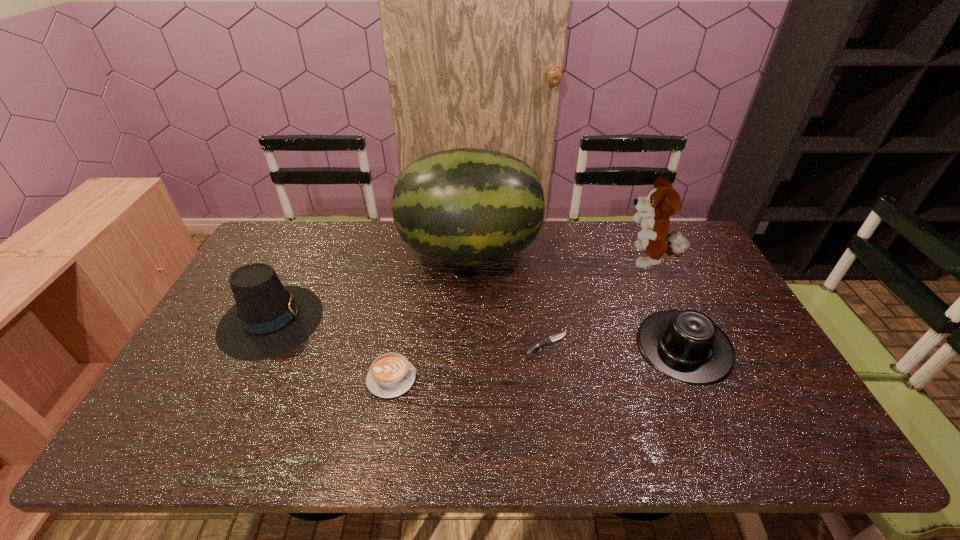
Identify the location of free area in between the fourth tallest object and the shortest object. (615, 346).

At what (x,y) coordinates should I click in order to perform the action: click on vacant area between the shortest object and the leftmost object. Please return your answer as a coordinate pair (x, y). Looking at the image, I should click on [409, 333].

This screenshot has width=960, height=540. In order to click on vacant space in between the watermelon and the fifth shortest object in this screenshot , I will do `click(559, 256)`.

Image resolution: width=960 pixels, height=540 pixels. Find the location of `vacant point located between the puppy and the second shortest object`. vacant point located between the puppy and the second shortest object is located at coordinates (520, 320).

I want to click on vacant space that is in between the watermelon and the cappuccino, so click(431, 315).

You are a GUI agent. You are given a task and a screenshot of the screen. Output one action in this format:
    pyautogui.click(x=<x>, y=<y>)
    Task: Click on the free area in between the fifth shortest object and the watermelon
    This screenshot has height=540, width=960.
    Given the screenshot: What is the action you would take?
    pyautogui.click(x=559, y=256)

The height and width of the screenshot is (540, 960). Find the location of `vacant space that's between the pocketknife and the leftmost object`. vacant space that's between the pocketknife and the leftmost object is located at coordinates (409, 333).

Identify the location of free space between the second shortest object and the leftmost object. This screenshot has height=540, width=960. (332, 349).

The image size is (960, 540). What are the coordinates of `the third closest object to the leftmost object` in the screenshot? It's located at (548, 340).

Where is `object that ranks as the closest to the shorter dress hat`? object that ranks as the closest to the shorter dress hat is located at coordinates (663, 201).